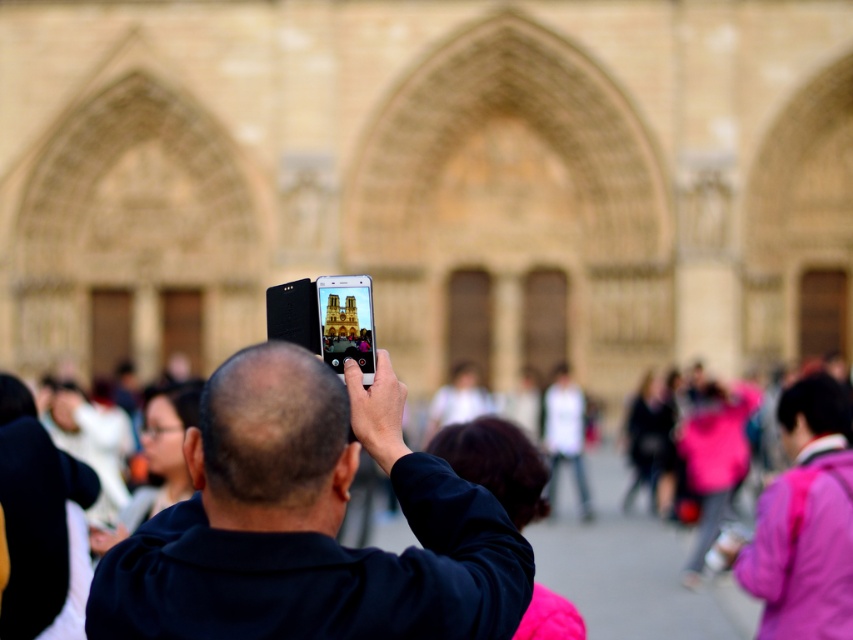
You are a photographer trying to capture a clear shot of the black matte smartphone at center. However, there is an obstruction caused by the dark blue fabric jacket at center. Based on their positions, can you adjust your angle to avoid the jacket while still keeping the smartphone in frame?

The dark blue fabric jacket at center is to the right of the black matte smartphone at center. To avoid the jacket while keeping the smartphone in frame, you should move your angle to the right side so the jacket moves out of the frame, leaving the smartphone visible.

You are a photographer trying to capture a clear shot of the Notre Dame Cathedral. You are holding a dark blue fabric jacket at center and a black matte smartphone at center. Which object should you move closer to the camera to ensure the smartphone is fully visible in the photo?

The dark blue fabric jacket at center is larger in size than the black matte smartphone at center. To ensure the smartphone is fully visible, you should move the black matte smartphone at center closer to the camera since it is smaller and needs to be in focus.